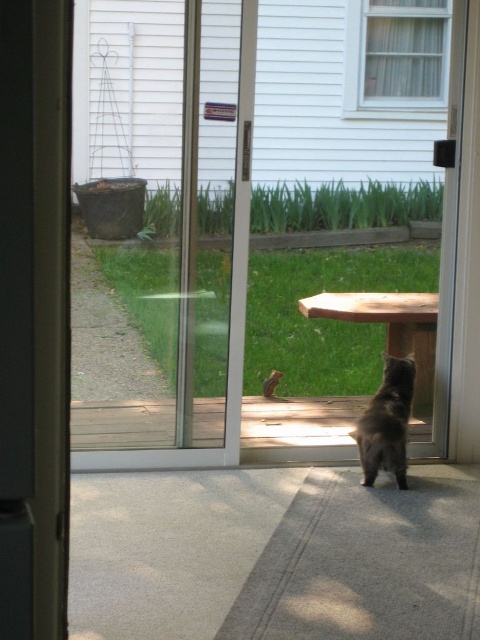
You are standing inside the house and want to exit through the transparent glass screen door at center. Based on the scene description, where should you walk towards to reach the door?

The transparent glass screen door at center is located at point (229, 300), so you should walk towards the center of the image to reach the door.

You are a delivery person trying to deliver a package to the house. You see the transparent glass screen door at center and the dark gray fur cat at center. Which object is bigger in size?

The transparent glass screen door at center is larger in size compared to the dark gray fur cat at center according to the description.

You are standing inside the house and want to let the dark gray fur cat at center outside. Since the transparent glass screen door at center is partially open, can you safely open it further to let the cat through without blocking its path?

The transparent glass screen door at center is to the left of the dark gray fur cat at center, so opening it further would not block the cat from exiting through the door. The cat can move to the right of the door to go outside safely.